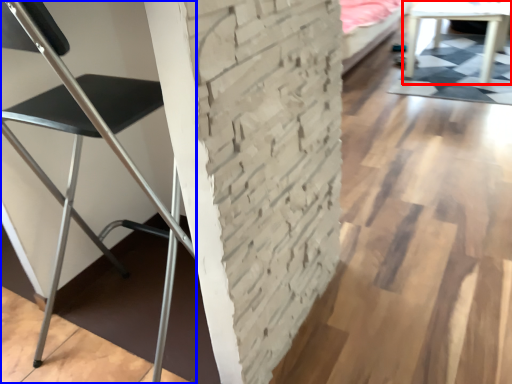
Question: Which point is further to the camera, table (highlighted by a red box) or chair (highlighted by a blue box)?

Choices:
 (A) table
 (B) chair

Answer: (A)